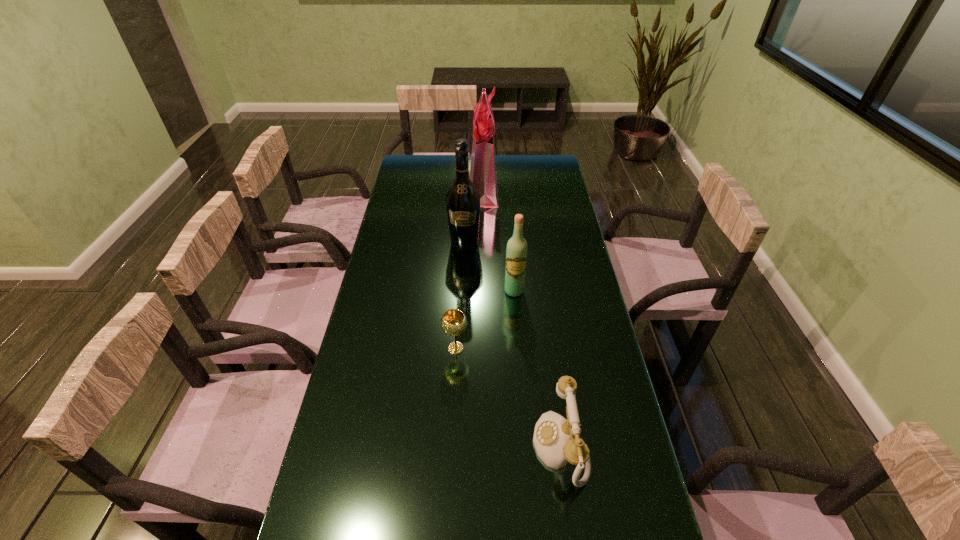
At what (x,y) coordinates should I click in order to perform the action: click on vacant space located 0.240m on the dial of the nearest object. Please return your answer as a coordinate pair (x, y). Image resolution: width=960 pixels, height=540 pixels. Looking at the image, I should click on pos(438,446).

Where is `vacant space located 0.270m on the dial of the nearest object`? Image resolution: width=960 pixels, height=540 pixels. vacant space located 0.270m on the dial of the nearest object is located at coordinates (425, 446).

The image size is (960, 540). What are the coordinates of `vacant space located 0.340m on the dial of the nearest object` in the screenshot? It's located at (397, 446).

Find the location of a particular element. The image size is (960, 540). vacant region located on the front of the chalice is located at coordinates (453, 404).

Find the location of `object located at the far edge`. object located at the far edge is located at coordinates (482, 169).

Locate an element on the screen. This screenshot has width=960, height=540. object present at the right edge is located at coordinates (557, 441).

At what (x,y) coordinates should I click in order to perform the action: click on free space at the far edge of the desktop. Please return your answer as a coordinate pair (x, y). This screenshot has height=540, width=960. Looking at the image, I should click on (438, 170).

The height and width of the screenshot is (540, 960). I want to click on blank space at the left edge of the desktop, so click(414, 263).

Image resolution: width=960 pixels, height=540 pixels. Identify the location of free space at the right edge. (612, 383).

Locate an element on the screen. The image size is (960, 540). free space that is in between the chalice and the nearest object is located at coordinates (508, 397).